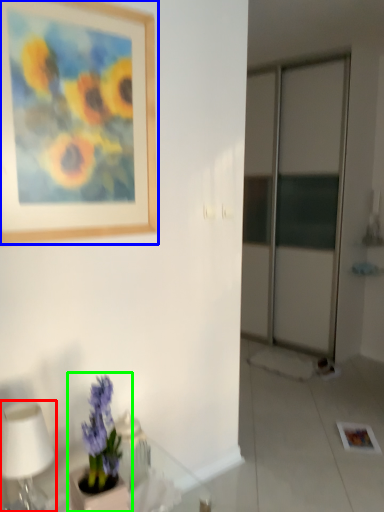
Question: Which is nearer to the table lamp (highlighted by a red box)? picture frame (highlighted by a blue box) or houseplant (highlighted by a green box).

Choices:
 (A) picture frame
 (B) houseplant

Answer: (B)